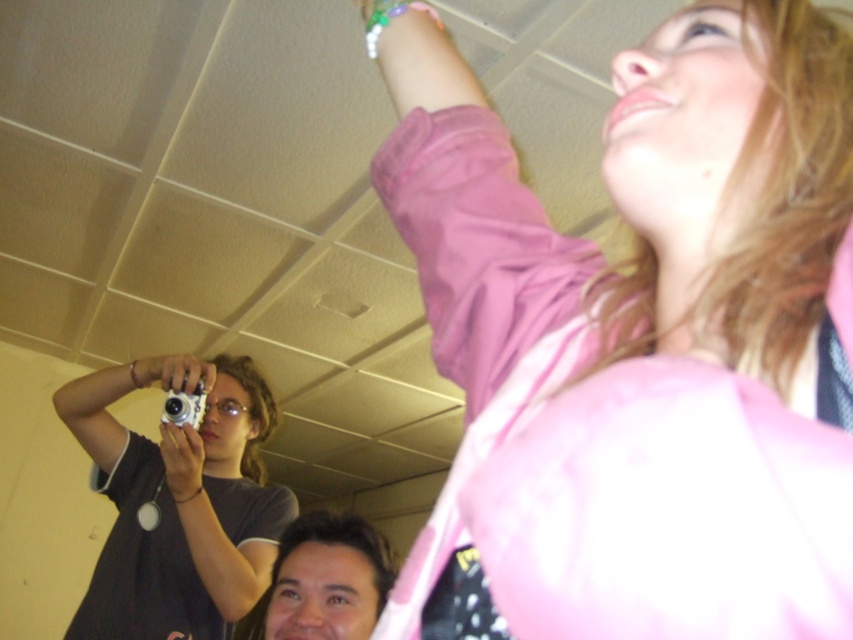
You are a photographer trying to capture a candid shot of the person in the pink top. The smooth brown hair at lower center and the matte silver camera at upper left are both in your viewfinder. Which object should you adjust your focus to ensure the person is clearly visible?

The smooth brown hair at lower center is in front of the matte silver camera at upper left. To ensure the person in the pink top is clearly visible, you should adjust your focus to the smooth brown hair at lower center since it is closer to the camera and blocking the view.

You are standing in a room with a person wearing a pink top and another person with smooth brown hair. You need to hang a picture frame on the wall between them. Which object, the pink fabric at upper right or the smooth brown hair at lower center, should you avoid placing the frame near to ensure it doesn t block their view?

The pink fabric at upper right is taller than the smooth brown hair at lower center. To avoid blocking their view, you should avoid placing the frame near the pink fabric at upper right since it is taller and might obstruct the line of sight more than the smooth brown hair at lower center.

You are an interior designer assessing the space for a client. You notice the pink fabric at upper right and the smooth brown hair at lower center. Which object occupies more visual space in the scene?

The pink fabric at upper right occupies more visual space in the scene because it has a larger size compared to the smooth brown hair at lower center.